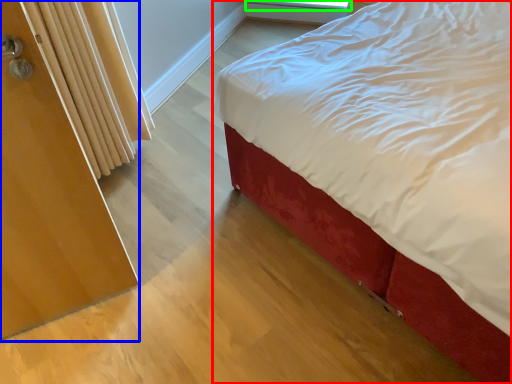
Question: Which object is positioned closest to bed (highlighted by a red box)? Select from screen door (highlighted by a blue box) and window screen (highlighted by a green box).

Choices:
 (A) screen door
 (B) window screen

Answer: (A)